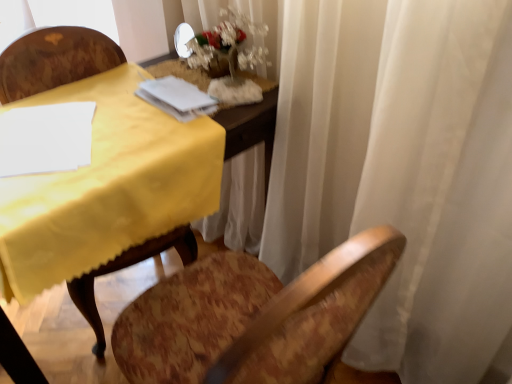
The width and height of the screenshot is (512, 384). What are the coordinates of `free location to the left of white paper at upper center` in the screenshot? It's located at (105, 103).